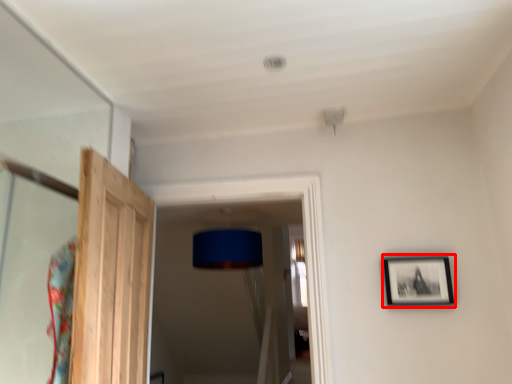
Question: Where is picture frame (annotated by the red box) located in relation to door in the image?

Choices:
 (A) left
 (B) right

Answer: (B)